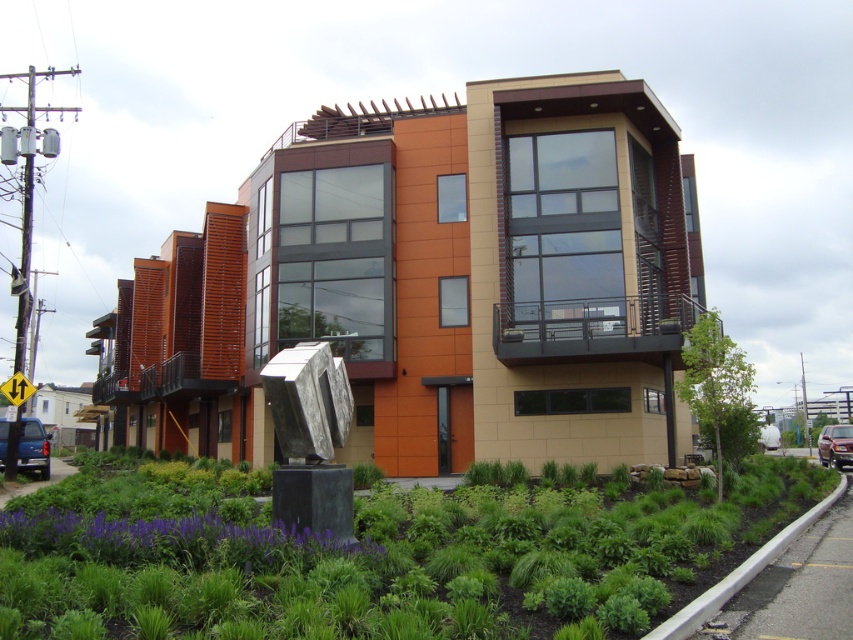
You are a visitor approaching the building and see the green leafy plant at center and the shiny black sedan at lower right. Which object is positioned closer to the entrance of the building?

The green leafy plant at center is to the left of the shiny black sedan at lower right, so it is closer to the entrance of the building.

You are a visitor arriving at the building and need to park your car. You see a matte blue truck at lower left and a shiny black sedan at lower right. Which parking spot can accommodate a larger vehicle?

The matte blue truck at lower left is larger in size than the shiny black sedan at lower right, so the parking spot where the matte blue truck is parked can accommodate larger vehicles.